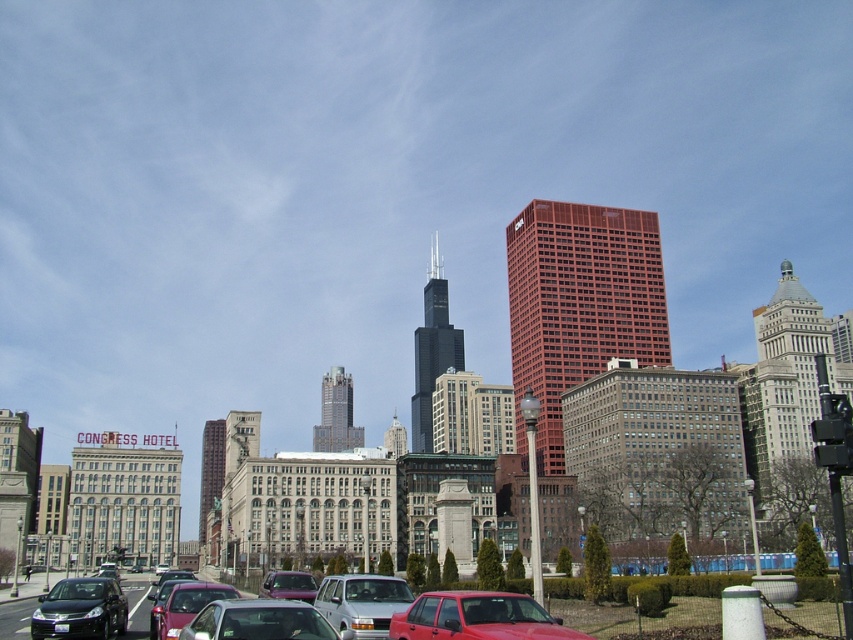
Consider the image. Who is positioned more to the right, black glass skyscraper at center or shiny silver skyscraper at center?

black glass skyscraper at center

Is black glass skyscraper at center further to the viewer compared to shiny silver skyscraper at center?

That is False.

The width and height of the screenshot is (853, 640). Describe the element at coordinates (432, 352) in the screenshot. I see `black glass skyscraper at center` at that location.

The image size is (853, 640). What are the coordinates of `black glass skyscraper at center` in the screenshot? It's located at (432, 352).

Can you confirm if matte silver car at center is wider than matte black sedan at lower left?

No.

Can you confirm if matte silver car at center is taller than matte black sedan at lower left?

No.

Who is more distant from viewer, [254,634] or [71,584]?

Point [71,584]

Find the location of a particular element. matte silver car at center is located at coordinates (257, 621).

Which is below, matte red car at lower center or silver metallic van at center?

silver metallic van at center

Is matte red car at lower center further to the viewer compared to silver metallic van at center?

No, it is not.

Which is behind, point (480, 608) or point (386, 580)?

The point (386, 580) is behind.

Where is `matte red car at lower center`? matte red car at lower center is located at coordinates (477, 618).